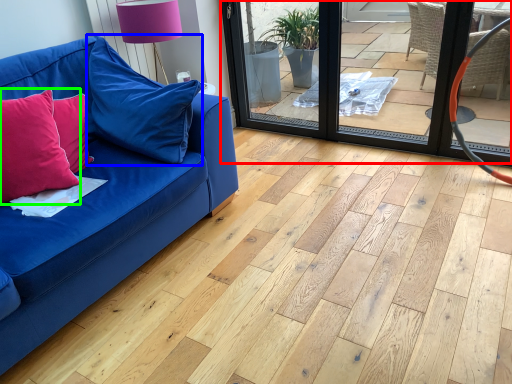
Question: Based on their relative distances, which object is farther from screen door (highlighted by a red box)? Choose from pillow (highlighted by a blue box) and pillow (highlighted by a green box).

Choices:
 (A) pillow
 (B) pillow

Answer: (B)